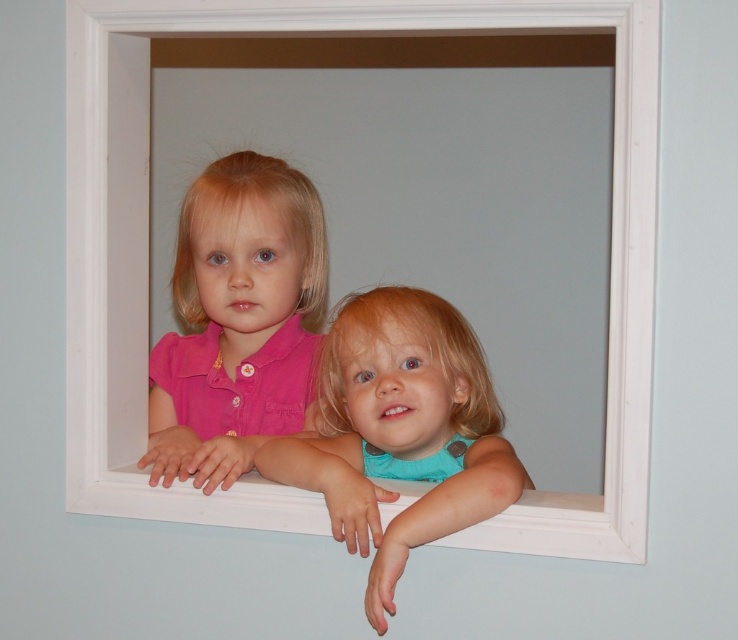
Question: Does pink matte shirt at center appear on the left side of turquoise matte shirt at center?

Choices:
 (A) yes
 (B) no

Answer: (A)

Question: Which object is farther from the camera taking this photo?

Choices:
 (A) turquoise matte shirt at center
 (B) pink matte shirt at center

Answer: (B)

Question: Which point is farther to the camera?

Choices:
 (A) (341, 435)
 (B) (579, 513)

Answer: (A)

Question: Does white wooden window frame at center have a lesser width compared to pink matte shirt at center?

Choices:
 (A) yes
 (B) no

Answer: (B)

Question: Where is pink matte shirt at center located in relation to turquoise matte shirt at center in the image?

Choices:
 (A) above
 (B) below

Answer: (A)

Question: Which object is farther from the camera taking this photo?

Choices:
 (A) turquoise matte shirt at center
 (B) pink matte shirt at center

Answer: (B)